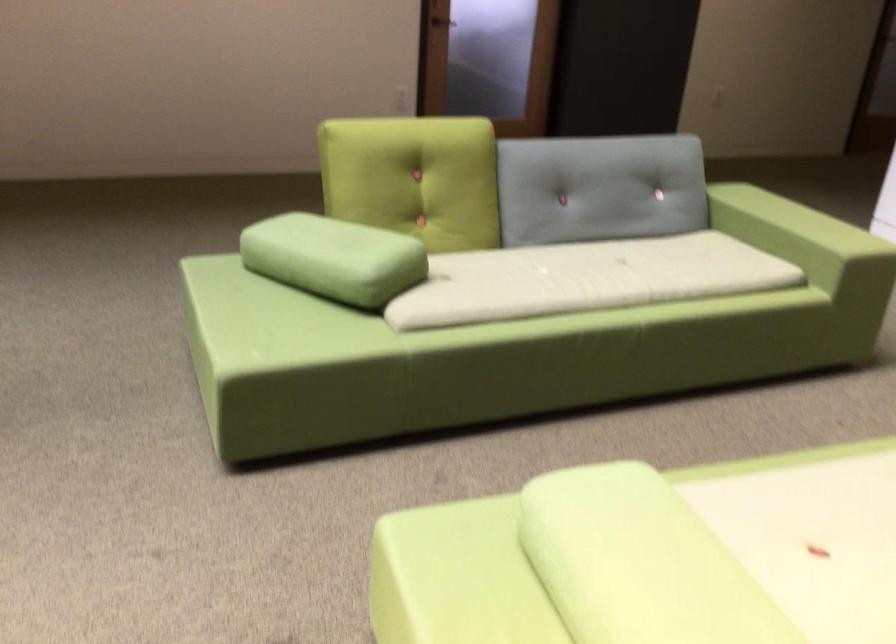
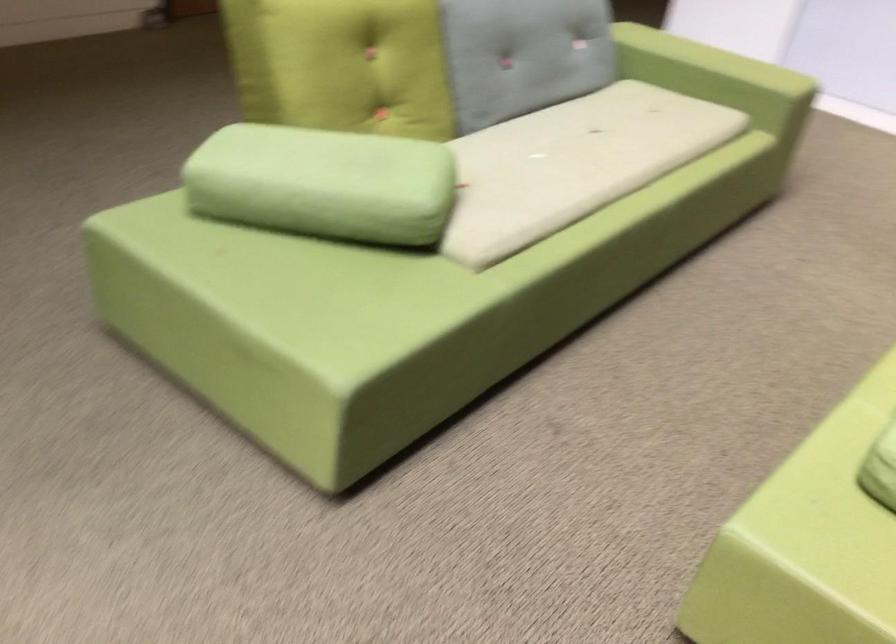
In the second image, find the point that corresponds to pixel 309 249 in the first image.

(323, 184)